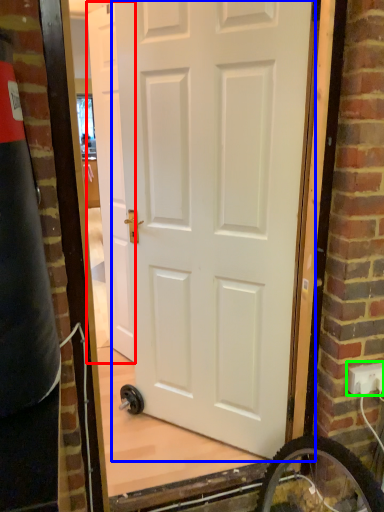
Question: Which object is the closest to the door (highlighted by a red box)? Choose among these: door (highlighted by a blue box) or electric outlet (highlighted by a green box).

Choices:
 (A) door
 (B) electric outlet

Answer: (A)